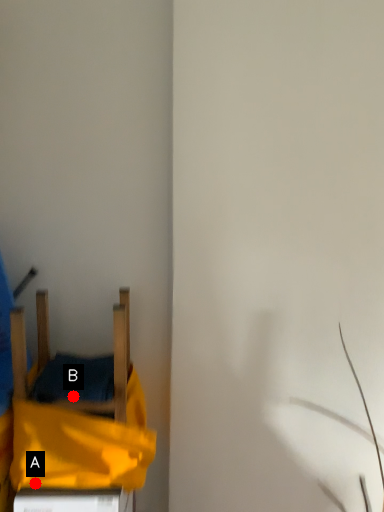
Question: Two points are circled on the image, labeled by A and B beside each circle. Among these points, which one is farthest from the camera?

Choices:
 (A) A is further
 (B) B is further

Answer: (B)